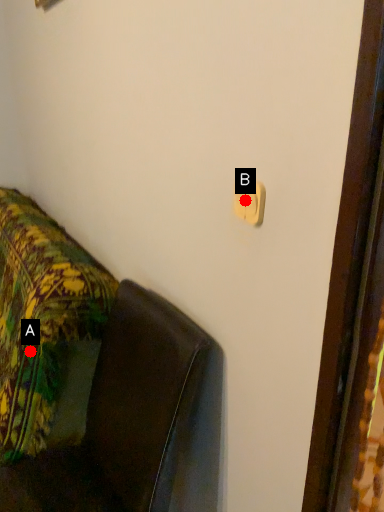
Question: Two points are circled on the image, labeled by A and B beside each circle. Which point is closer to the camera taking this photo?

Choices:
 (A) A is closer
 (B) B is closer

Answer: (B)